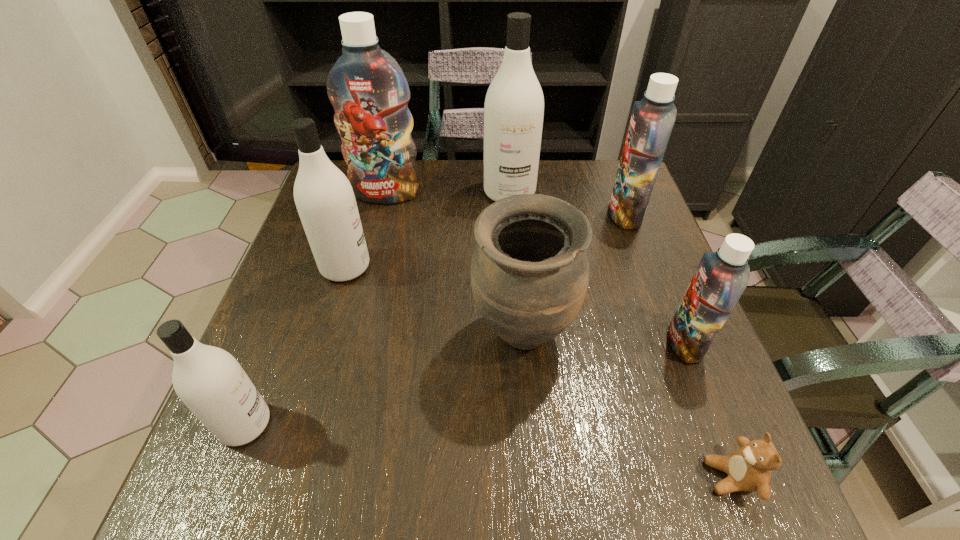
The image size is (960, 540). I want to click on free space between the teddy bear and the urn, so click(x=627, y=406).

This screenshot has height=540, width=960. Find the location of `unoccupied area between the leftmost blue shampoo and the farthest white shampoo`. unoccupied area between the leftmost blue shampoo and the farthest white shampoo is located at coordinates (448, 193).

Where is `the third closest object to the rightmost white shampoo`? Image resolution: width=960 pixels, height=540 pixels. the third closest object to the rightmost white shampoo is located at coordinates (324, 197).

Find the location of a particular element. This screenshot has height=540, width=960. object that ranks as the closest to the smallest blue shampoo is located at coordinates (749, 468).

Where is `shampoo that is the fourth closest to the nearest white shampoo`? shampoo that is the fourth closest to the nearest white shampoo is located at coordinates (721, 277).

This screenshot has height=540, width=960. I want to click on shampoo that is the fourth closest one to the fifth farthest shampoo, so click(x=369, y=92).

This screenshot has width=960, height=540. What are the coordinates of `white shampoo object that ranks as the closest to the biggest blue shampoo` in the screenshot? It's located at (514, 105).

Find the location of a particular element. The width and height of the screenshot is (960, 540). white shampoo that is the third closest to the shortest object is located at coordinates (209, 380).

Locate an element on the screen. The image size is (960, 540). blue shampoo that stands as the third closest to the nearest shampoo is located at coordinates (652, 120).

Find the location of a particular element. blue shampoo that is the third nearest to the second smallest white shampoo is located at coordinates (721, 277).